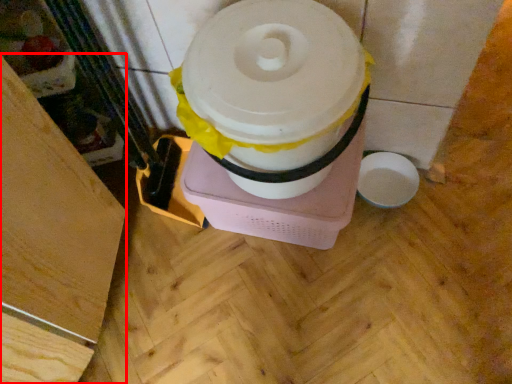
Question: From the image's perspective, what is the correct spatial positioning of wood (annotated by the red box) in reference to toilet paper?

Choices:
 (A) below
 (B) above

Answer: (A)